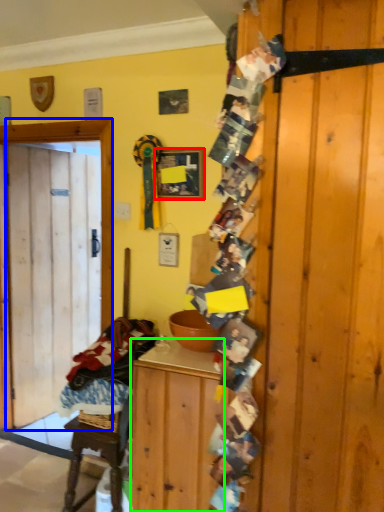
Question: Estimate the real-world distances between objects in this image. Which object is closer to picture frame (highlighted by a red box), door (highlighted by a blue box) or cabinetry (highlighted by a green box)?

Choices:
 (A) door
 (B) cabinetry

Answer: (A)